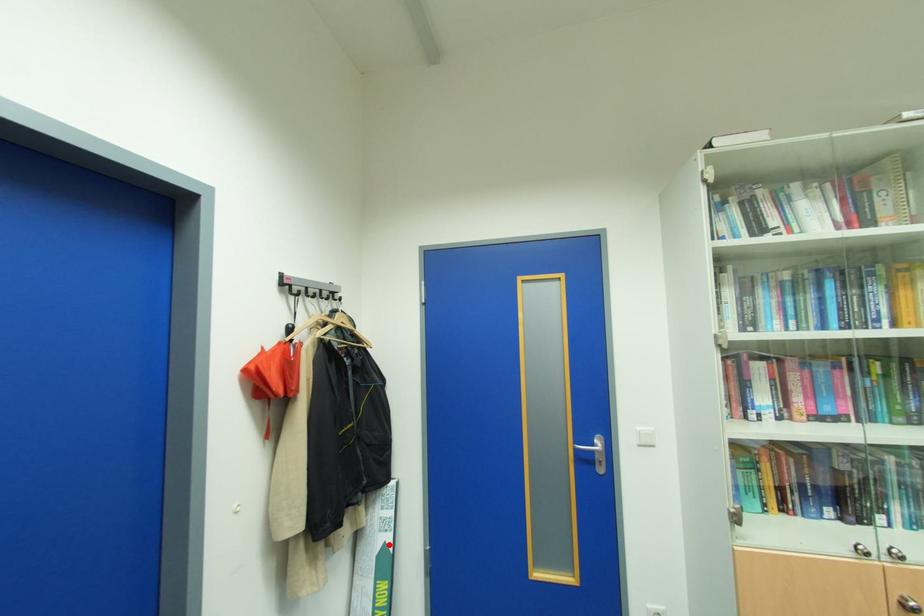
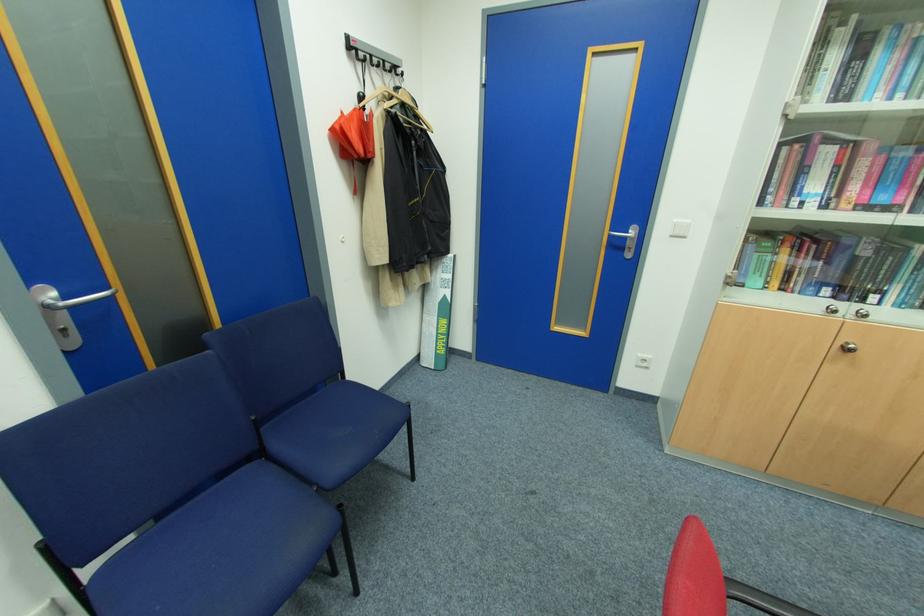
Question: I am providing you with two images of the same scene from different viewpoints. In image1, a red point is highlighted. Considering the same 3D point in image2, which of the following is correct?

Choices:
 (A) It is closer
 (B) It is farther

Answer: (A)